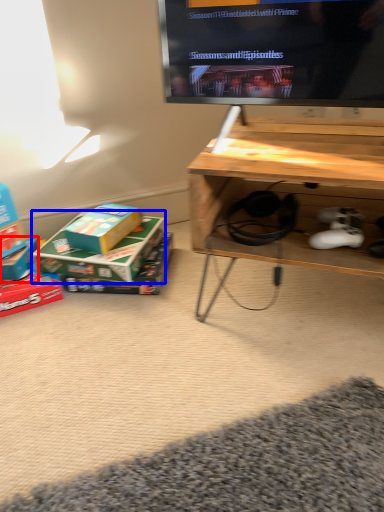
Question: Which of the following is the farthest to the observer, box (highlighted by a red box) or box (highlighted by a blue box)?

Choices:
 (A) box
 (B) box

Answer: (A)